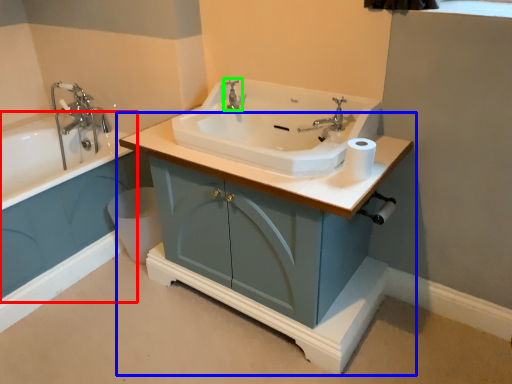
Question: Which object is positioned closest to bath (highlighted by a red box)? Select from bathroom cabinet (highlighted by a blue box) and tap (highlighted by a green box).

Choices:
 (A) bathroom cabinet
 (B) tap

Answer: (A)